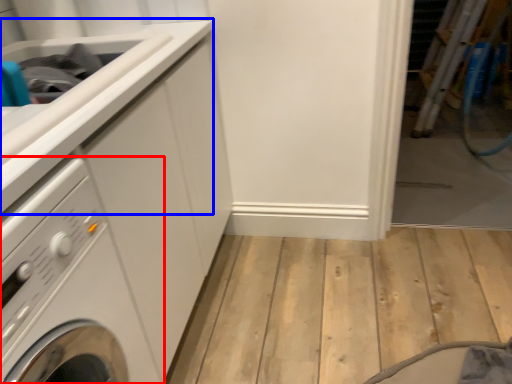
Question: Which object appears farthest to the camera in this image, washing machine (highlighted by a red box) or counter top (highlighted by a blue box)?

Choices:
 (A) washing machine
 (B) counter top

Answer: (B)